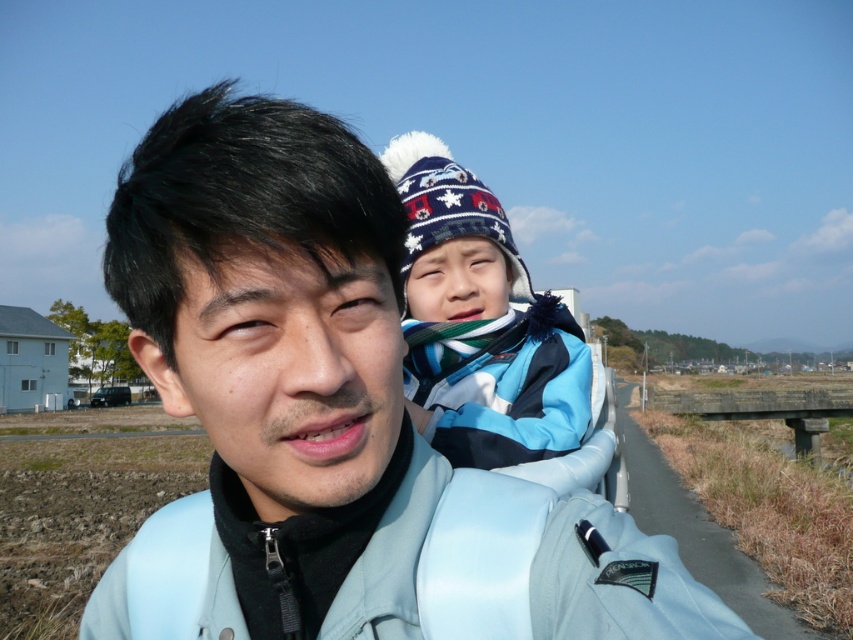
Question: Among these points, which one is nearest to the camera?

Choices:
 (A) (300, 109)
 (B) (447, 307)

Answer: (A)

Question: Is blue fleece jacket at upper center wider than blue fleece jacket at center?

Choices:
 (A) no
 (B) yes

Answer: (B)

Question: Which of the following is the farthest from the observer?

Choices:
 (A) (546, 310)
 (B) (520, 346)

Answer: (A)

Question: Which point appears farthest from the camera in this image?

Choices:
 (A) (543, 358)
 (B) (358, 317)
 (C) (578, 352)

Answer: (C)

Question: Considering the relative positions of blue fleece jacket at upper center and blue fleece jacket at center in the image provided, where is blue fleece jacket at upper center located with respect to blue fleece jacket at center?

Choices:
 (A) below
 (B) above

Answer: (B)

Question: Can you confirm if light blue jacket at center is thinner than blue fleece jacket at upper center?

Choices:
 (A) yes
 (B) no

Answer: (B)